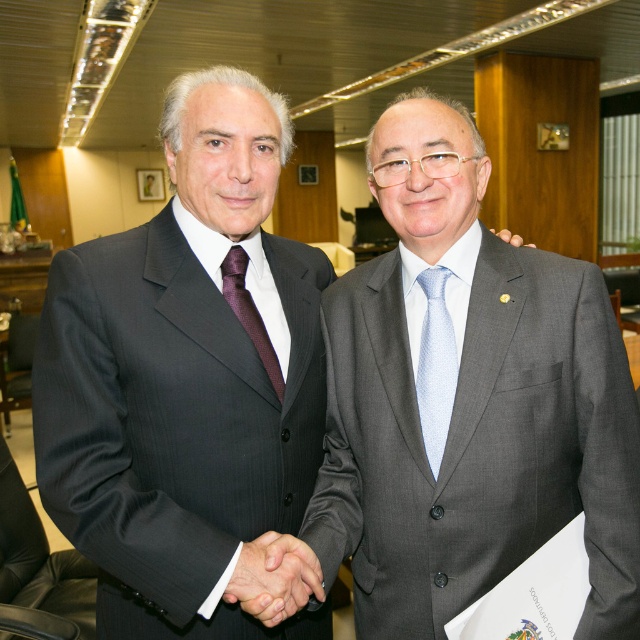
You are standing in an office and see the gray matte suit at center and the light blue textured tie at center. Which object is nearer to you?

The gray matte suit at center is closer to the viewer than the light blue textured tie at center.

You are a tailor observing two formal attire items in an office scene. The gray matte suit at center and the light blue textured tie at center are part of a mannequin display. Which item would require more fabric to create?

The gray matte suit at center requires more fabric to create because it has a larger size compared to the light blue textured tie at center.